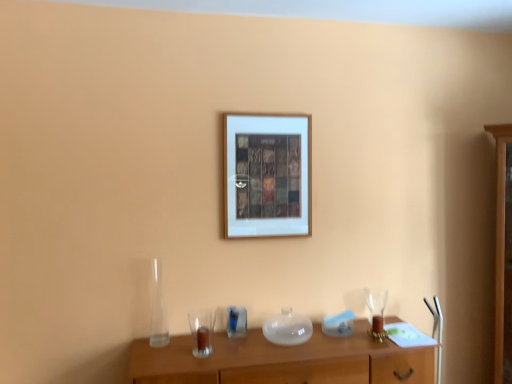
Find the location of a particular element. vacant area that lies to the right of transparent glass vase at lower left is located at coordinates (190, 334).